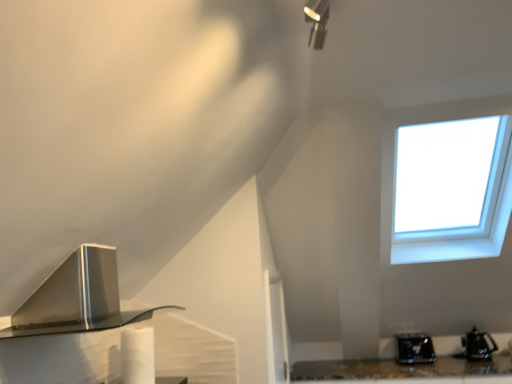
Question: Does shiny black toaster at lower right, the first appliance positioned from the left, have a lesser width compared to satin silver range hood at lower left?

Choices:
 (A) no
 (B) yes

Answer: (B)

Question: Is shiny black toaster at lower right, which is the 2th appliance from right to left, bigger than satin silver range hood at lower left?

Choices:
 (A) yes
 (B) no

Answer: (B)

Question: Can you confirm if shiny black toaster at lower right, the first appliance positioned from the left, is shorter than satin silver range hood at lower left?

Choices:
 (A) no
 (B) yes

Answer: (B)

Question: From a real-world perspective, is shiny black toaster at lower right, the first appliance positioned from the left, under satin silver range hood at lower left?

Choices:
 (A) no
 (B) yes

Answer: (B)

Question: Does shiny black toaster at lower right, which is the 2th appliance from right to left, have a smaller size compared to satin silver range hood at lower left?

Choices:
 (A) yes
 (B) no

Answer: (A)

Question: Does shiny black toaster at lower right, which is the 2th appliance from right to left, touch satin silver range hood at lower left?

Choices:
 (A) yes
 (B) no

Answer: (B)

Question: Can you confirm if satin silver range hood at lower left is positioned to the right of shiny black toaster at lower right, the first appliance positioned from the left?

Choices:
 (A) yes
 (B) no

Answer: (B)

Question: Is satin silver range hood at lower left oriented away from shiny black toaster at lower right, the first appliance positioned from the left?

Choices:
 (A) yes
 (B) no

Answer: (B)

Question: Can you confirm if satin silver range hood at lower left is taller than shiny black toaster at lower right, which is the 2th appliance from right to left?

Choices:
 (A) no
 (B) yes

Answer: (B)

Question: Is satin silver range hood at lower left wider than shiny black toaster at lower right, the first appliance positioned from the left?

Choices:
 (A) yes
 (B) no

Answer: (A)

Question: From the image's perspective, is satin silver range hood at lower left located beneath shiny black toaster at lower right, the first appliance positioned from the left?

Choices:
 (A) no
 (B) yes

Answer: (A)

Question: Is satin silver range hood at lower left with shiny black toaster at lower right, which is the 2th appliance from right to left?

Choices:
 (A) no
 (B) yes

Answer: (A)

Question: Would you say shiny black toaster at lower right, the first appliance positioned from the left, is a long distance from black plastic kettle at lower right, marked as the 2th appliance in a left-to-right arrangement?

Choices:
 (A) no
 (B) yes

Answer: (A)